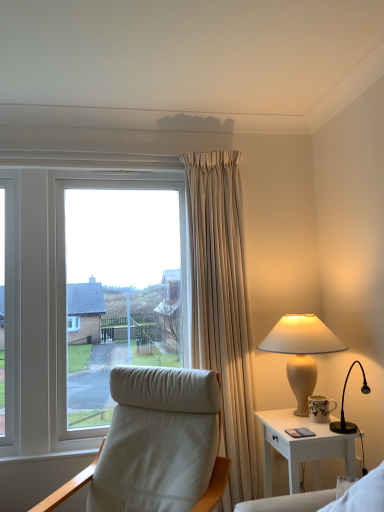
Question: From a real-world perspective, relative to white leather chair at left, is matte beige lamp at right vertically above or below?

Choices:
 (A) below
 (B) above

Answer: (B)

Question: From the image's perspective, is matte beige lamp at right located above or below white leather chair at left?

Choices:
 (A) above
 (B) below

Answer: (A)

Question: Which is farther from the matte beige lamp at right?

Choices:
 (A) white glossy nightstand at right
 (B) white leather chair at left
 (C) white leather couch at lower right

Answer: (B)

Question: Considering the real-world distances, which object is closest to the white leather couch at lower right?

Choices:
 (A) white glossy nightstand at right
 (B) matte beige lamp at right
 (C) white leather chair at left

Answer: (A)